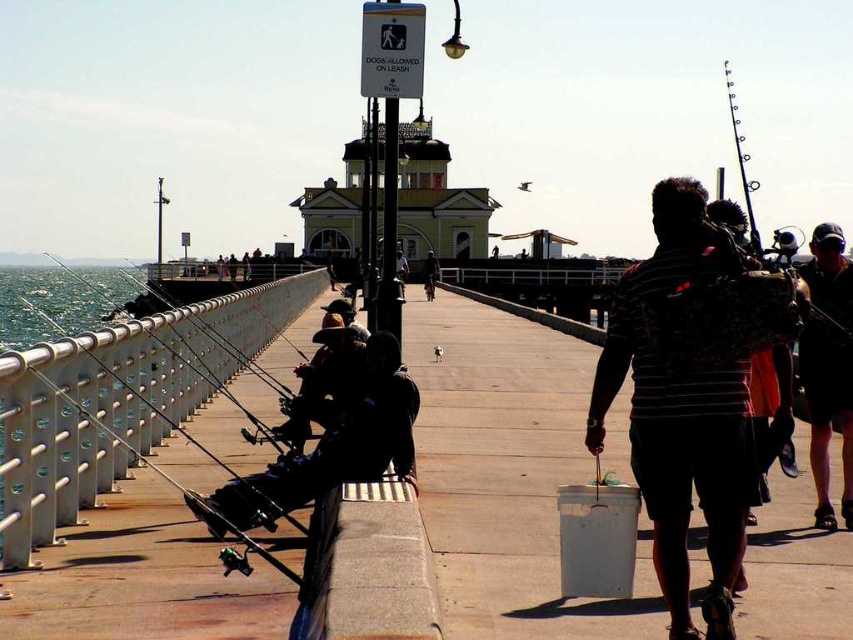
Question: Which object is closer to the camera taking this photo?

Choices:
 (A) silhouette fishing rod at left
 (B) clear water at railing left
 (C) black fabric cap at upper right
 (D) dark blue jeans at center

Answer: (B)

Question: Can you confirm if striped cotton shirt at center is positioned below dark blue jeans at center?

Choices:
 (A) yes
 (B) no

Answer: (A)

Question: Which point is farther to the camera?

Choices:
 (A) dark blue jeans at center
 (B) black fabric cap at upper right
 (C) clear water at railing left
 (D) silhouette fishing rod at left

Answer: (A)

Question: Which of the following is the farthest from the observer?

Choices:
 (A) silhouette fishing rod at left
 (B) striped cotton shirt at center
 (C) black fabric cap at upper right

Answer: (C)

Question: Is striped cotton shirt at center to the right of dark blue jeans at center from the viewer's perspective?

Choices:
 (A) yes
 (B) no

Answer: (A)

Question: Can you confirm if clear water at railing left is wider than striped cotton shirt at center?

Choices:
 (A) no
 (B) yes

Answer: (B)